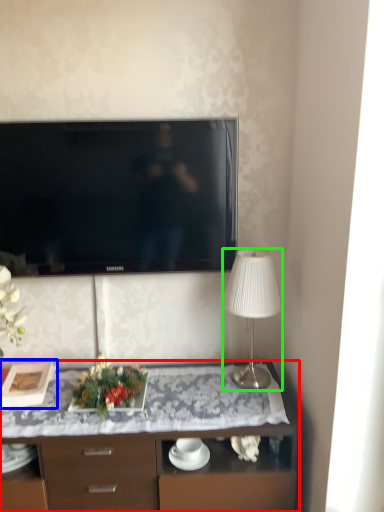
Question: Which object is positioned farthest from desk (highlighted by a red box)? Select from picture frame (highlighted by a blue box) and lamp (highlighted by a green box).

Choices:
 (A) picture frame
 (B) lamp

Answer: (A)